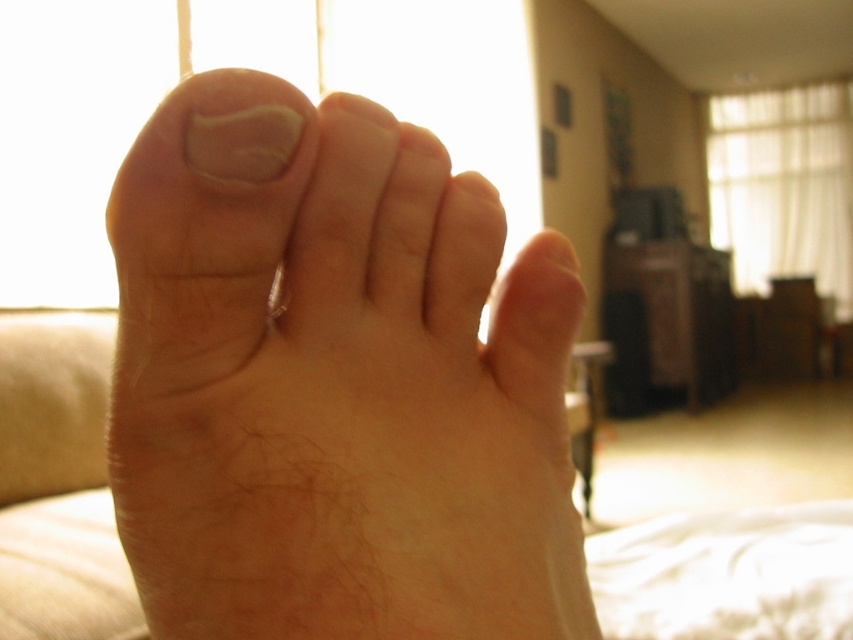
Question: Among these points, which one is nearest to the camera?

Choices:
 (A) (538, 310)
 (B) (48, 584)

Answer: (A)

Question: Does pale skin foot at center come in front of white soft bed at lower left?

Choices:
 (A) yes
 (B) no

Answer: (A)

Question: Does pale skin foot at center appear on the right side of white soft bed at lower left?

Choices:
 (A) no
 (B) yes

Answer: (B)

Question: Can you confirm if pale skin foot at center is smaller than white soft bed at lower left?

Choices:
 (A) no
 (B) yes

Answer: (B)

Question: Among these objects, which one is nearest to the camera?

Choices:
 (A) white soft bed at lower left
 (B) pale skin foot at center

Answer: (B)